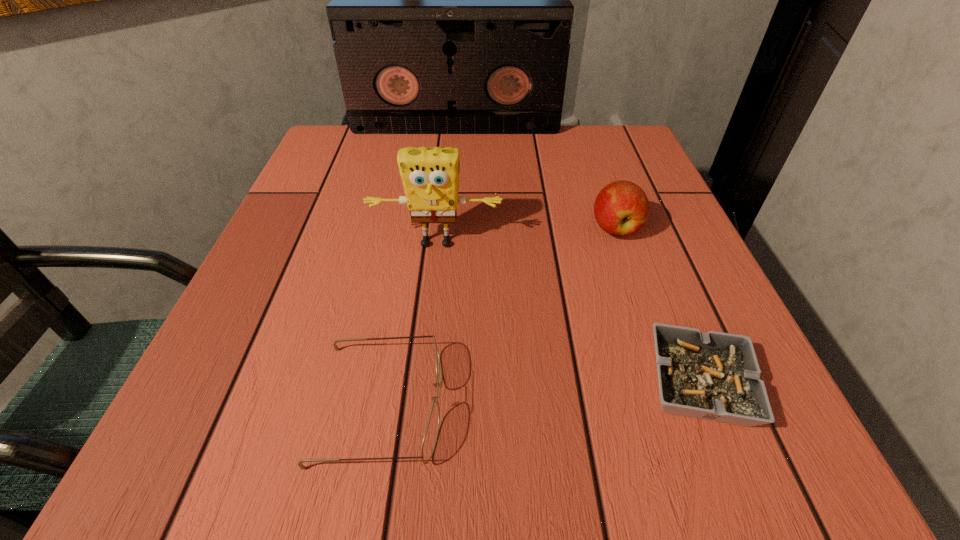
Locate an element on the screen. The height and width of the screenshot is (540, 960). vacant space that satisfies the following two spatial constraints: 1. on the face of the fourth shortest object; 2. on the front-facing side of the spectacles is located at coordinates (419, 404).